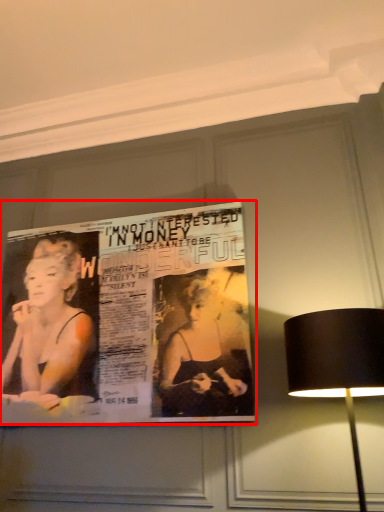
Question: From the image's perspective, what is the correct spatial relationship of poster (annotated by the red box) in relation to lamp?

Choices:
 (A) below
 (B) above

Answer: (B)